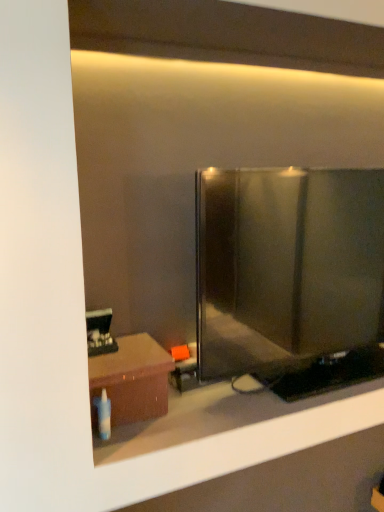
At what (x,y) coordinates should I click in order to perform the action: click on matte black glass door at center. Please return your answer as a coordinate pair (x, y). The height and width of the screenshot is (512, 384). Looking at the image, I should click on (286, 266).

What do you see at coordinates (286, 266) in the screenshot? I see `matte black glass door at center` at bounding box center [286, 266].

Describe the element at coordinates (131, 380) in the screenshot. I see `brown matte table at lower left` at that location.

You are a GUI agent. You are given a task and a screenshot of the screen. Output one action in this format:
    pyautogui.click(x=<x>, y=<y>)
    Task: Click on the brown matte table at lower left
    This screenshot has height=512, width=384.
    Given the screenshot: What is the action you would take?
    pyautogui.click(x=131, y=380)

Where is `matte black glass door at center`? matte black glass door at center is located at coordinates (286, 266).

Considering the relative positions of matte black glass door at center and brown matte table at lower left in the image provided, is matte black glass door at center to the right of brown matte table at lower left from the viewer's perspective?

Correct, you'll find matte black glass door at center to the right of brown matte table at lower left.

Considering the positions of objects matte black glass door at center and brown matte table at lower left in the image provided, who is behind, matte black glass door at center or brown matte table at lower left?

brown matte table at lower left is further from the camera.

Between point (259, 332) and point (154, 390), which one is positioned in front?

The point (154, 390) is in front.

From the image's perspective, would you say matte black glass door at center is positioned over brown matte table at lower left?

Yes, from the image's perspective, matte black glass door at center is on top of brown matte table at lower left.

From a real-world perspective, is matte black glass door at center located higher than brown matte table at lower left?

Yes.

Considering the relative sizes of matte black glass door at center and brown matte table at lower left in the image provided, is matte black glass door at center wider than brown matte table at lower left?

No, matte black glass door at center is not wider than brown matte table at lower left.

Considering the sizes of objects matte black glass door at center and brown matte table at lower left in the image provided, who is taller, matte black glass door at center or brown matte table at lower left?

matte black glass door at center.

Does matte black glass door at center have a smaller size compared to brown matte table at lower left?

No.

Is brown matte table at lower left located within matte black glass door at center?

No, brown matte table at lower left is located outside of matte black glass door at center.

Is matte black glass door at center with brown matte table at lower left?

No, matte black glass door at center is not next to brown matte table at lower left.

Is matte black glass door at center aimed at brown matte table at lower left?

No, matte black glass door at center is not aimed at brown matte table at lower left.

How many degrees apart are the facing directions of matte black glass door at center and brown matte table at lower left?

The angle between the facing direction of matte black glass door at center and the facing direction of brown matte table at lower left is 0.000708 degrees.

This screenshot has width=384, height=512. What are the coordinates of `glass door on the right side of brown matte table at lower left` in the screenshot? It's located at tap(286, 266).

Would you say brown matte table at lower left is to the left or to the right of matte black glass door at center in the picture?

brown matte table at lower left is positioned on matte black glass door at center's left side.

Which object is further away from the camera, brown matte table at lower left or matte black glass door at center?

brown matte table at lower left is further away from the camera.

Considering the positions of points (127, 408) and (198, 366), is point (127, 408) closer to camera compared to point (198, 366)?

Yes, point (127, 408) is in front of point (198, 366).

From the image's perspective, is brown matte table at lower left above or below matte black glass door at center?

From the image's perspective, brown matte table at lower left appears below matte black glass door at center.

Consider the image. From a real-world perspective, is brown matte table at lower left positioned over matte black glass door at center based on gravity?

No, from a real-world perspective, brown matte table at lower left is not above matte black glass door at center.

Is brown matte table at lower left wider than matte black glass door at center?

Correct, the width of brown matte table at lower left exceeds that of matte black glass door at center.

Considering the sizes of objects brown matte table at lower left and matte black glass door at center in the image provided, who is taller, brown matte table at lower left or matte black glass door at center?

matte black glass door at center.

Who is bigger, brown matte table at lower left or matte black glass door at center?

With larger size is matte black glass door at center.

Is brown matte table at lower left completely or partially outside of matte black glass door at center?

Absolutely, brown matte table at lower left is external to matte black glass door at center.

Is brown matte table at lower left positioned far away from matte black glass door at center?

No, brown matte table at lower left is in close proximity to matte black glass door at center.

Is brown matte table at lower left looking in the opposite direction of matte black glass door at center?

brown matte table at lower left is not turned away from matte black glass door at center.

What's the angular difference between brown matte table at lower left and matte black glass door at center's facing directions?

brown matte table at lower left and matte black glass door at center are facing 0.000708 degrees away from each other.

Measure the distance between brown matte table at lower left and matte black glass door at center.

14.39 inches.

Identify the location of table located below the matte black glass door at center (from the image's perspective). The height and width of the screenshot is (512, 384). (131, 380).

Identify the location of table on the left of the matte black glass door at center. This screenshot has height=512, width=384. (131, 380).

Where is `table below the matte black glass door at center (from the image's perspective)`? The height and width of the screenshot is (512, 384). table below the matte black glass door at center (from the image's perspective) is located at coordinates (131, 380).